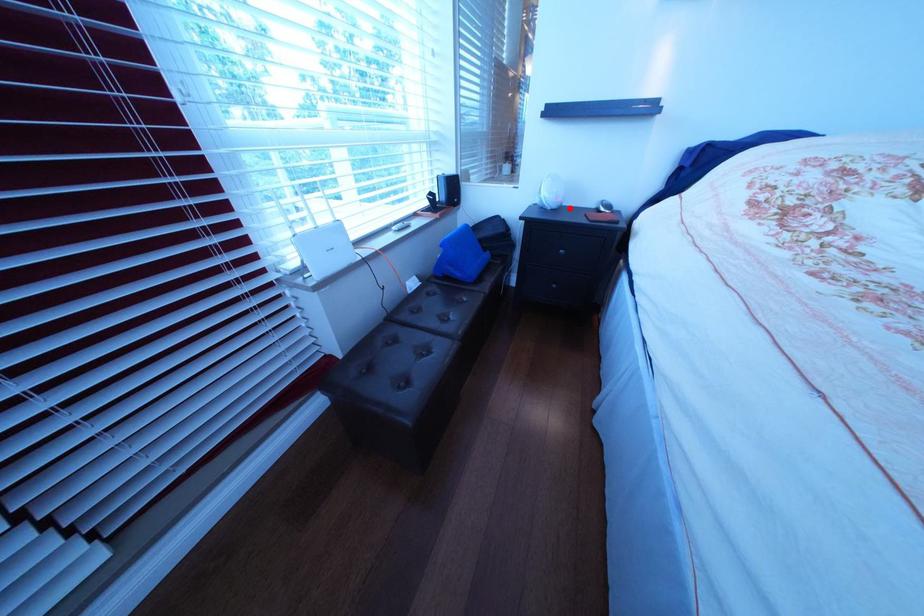
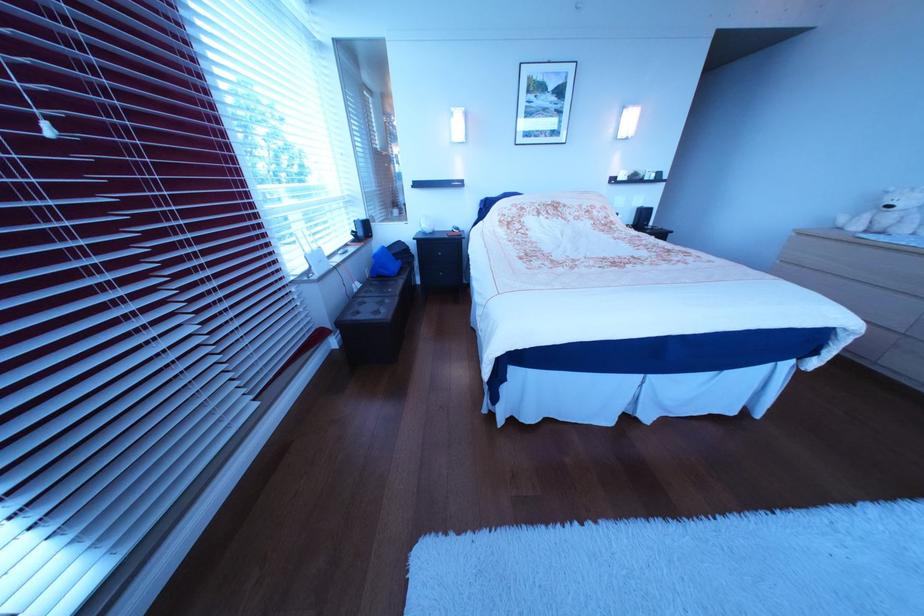
Find the pixel in the second image that matches the highlighted location in the first image.

(445, 233)